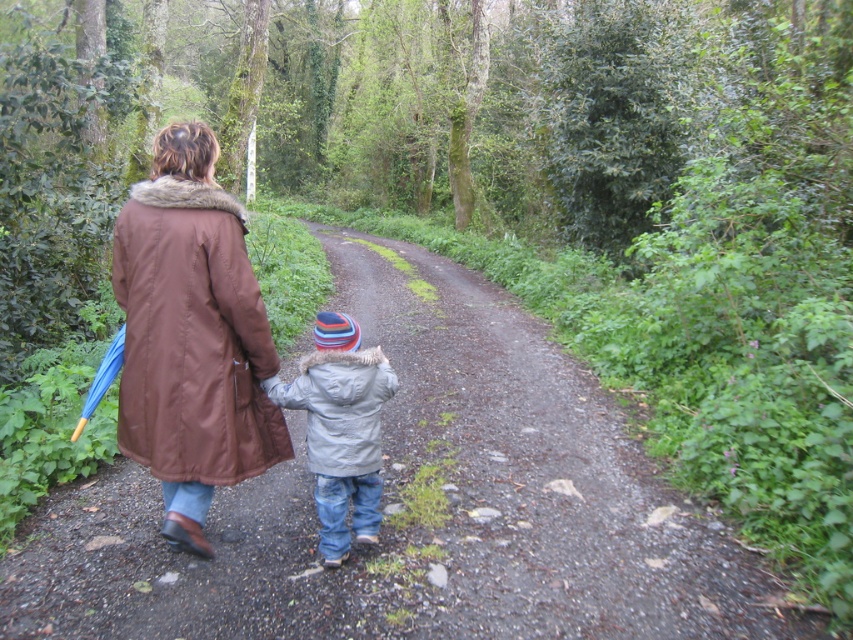
Question: Which of the following is the closest to the observer?

Choices:
 (A) (480, 496)
 (B) (355, 490)
 (C) (334, 436)

Answer: (C)

Question: Can you confirm if dirt road at center is bigger than gray matte jacket at center?

Choices:
 (A) yes
 (B) no

Answer: (A)

Question: Is dirt road at center further to the viewer compared to gray matte jacket at center?

Choices:
 (A) no
 (B) yes

Answer: (A)

Question: Which object is closer to the camera taking this photo?

Choices:
 (A) dirt road at center
 (B) gray fleece jacket at center

Answer: (A)

Question: Which of the following is the farthest from the observer?

Choices:
 (A) gray matte jacket at center
 (B) brown synthetic coat at back

Answer: (A)

Question: Can you confirm if dirt road at center is thinner than brown synthetic coat at back?

Choices:
 (A) yes
 (B) no

Answer: (B)